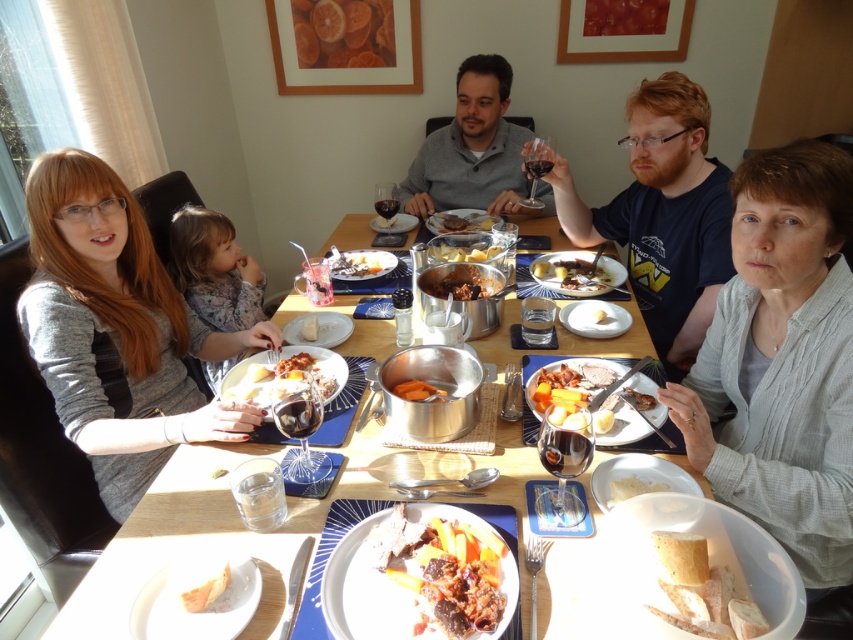
Can you confirm if slightly browned meat at center is positioned to the right of matte glass wine at center?

Yes, slightly browned meat at center is to the right of matte glass wine at center.

Identify the location of slightly browned meat at center. The width and height of the screenshot is (853, 640). (461, 221).

Is golden brown bread at center positioned in front of smooth brown gravy at center?

Yes, it is.

Is point (614, 368) less distant than point (599, 289)?

Yes, point (614, 368) is closer to viewer.

What do you see at coordinates (627, 413) in the screenshot? This screenshot has height=640, width=853. I see `golden brown bread at center` at bounding box center [627, 413].

Identify the location of golden brown bread at center. (627, 413).

Does golden brown bread at lower left come behind white creamy bread at lower right?

No, golden brown bread at lower left is closer to the viewer.

At what (x,y) coordinates should I click in order to perform the action: click on golden brown bread at lower left. Please return your answer as a coordinate pair (x, y). This screenshot has height=640, width=853. Looking at the image, I should click on (206, 589).